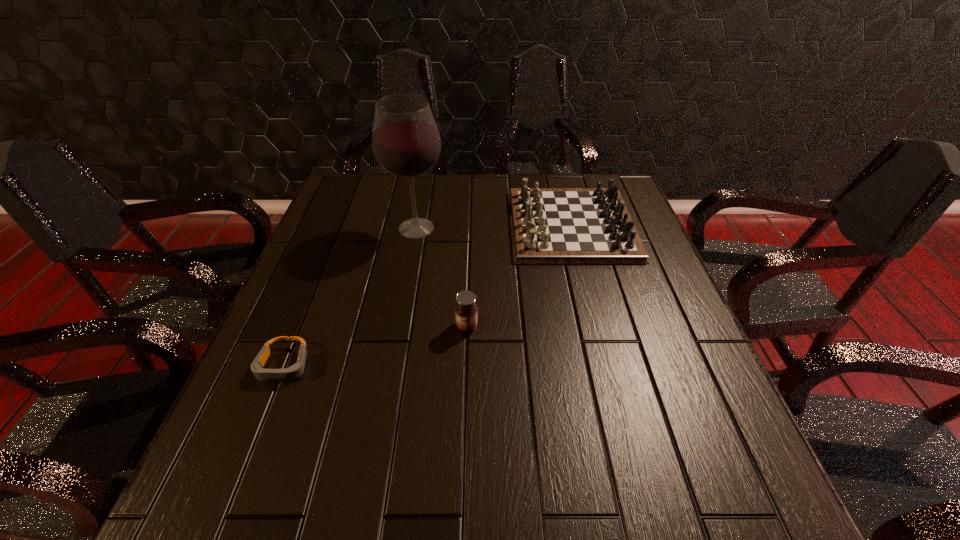
Where is `free space between the second object from right to left and the rightmost object`? The image size is (960, 540). free space between the second object from right to left and the rightmost object is located at coordinates (519, 275).

I want to click on empty space that is in between the shortest object and the alcohol, so coord(350,297).

Where is `free space that is in between the third object from left to right and the rightmost object`? The height and width of the screenshot is (540, 960). free space that is in between the third object from left to right and the rightmost object is located at coordinates (519, 275).

The height and width of the screenshot is (540, 960). I want to click on free space between the goggles and the chessboard, so click(x=427, y=295).

Where is `object that is the closest to the third object from left to right`? This screenshot has height=540, width=960. object that is the closest to the third object from left to right is located at coordinates (548, 225).

Where is `object that ranks as the third closest to the goggles`? The height and width of the screenshot is (540, 960). object that ranks as the third closest to the goggles is located at coordinates (548, 225).

In order to click on vacant space that satisfies the following two spatial constraints: 1. from the player's perspective of the rightmost object; 2. on the front and back of the nearest object in this screenshot , I will do `click(609, 366)`.

Identify the location of free space that satisfies the following two spatial constraints: 1. from the player's perspective of the chessboard; 2. on the front side of the tallest object. (572, 228).